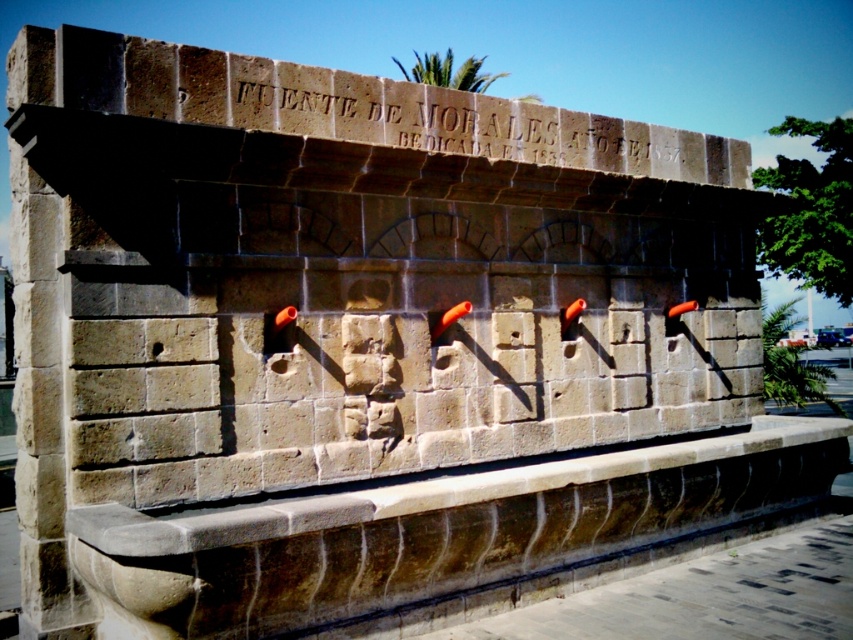
You are a tourist standing in front of the Fuente de Morales fountain. You want to touch both the smooth stone ledge at center and the stone inscription at upper center. Which one should you reach for first to touch the one closer to your left?

The stone inscription at upper center is to the left of the smooth stone ledge at center, so you should reach for the stone inscription at upper center first since it is closer to your left.

You are a tourist standing in front of the Fuente de Morales fountain. You notice the smooth stone ledge at center and the stone inscription at upper center. Which object is positioned higher up on the fountain?

The stone inscription at upper center is positioned higher up on the fountain than the smooth stone ledge at center.